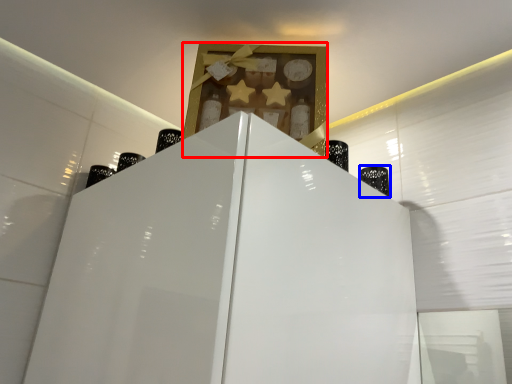
Question: Which object is closer to the camera taking this photo, cabinet (highlighted by a red box) or bottle (highlighted by a blue box)?

Choices:
 (A) cabinet
 (B) bottle

Answer: (A)